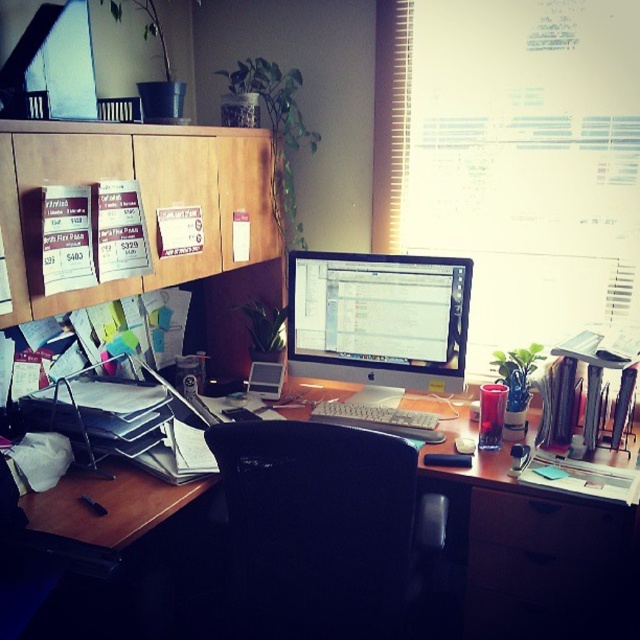
Is wooden desk at center thinner than satin black monitor at center?

Incorrect, wooden desk at center's width is not less than satin black monitor at center's.

Can you confirm if wooden desk at center is wider than satin black monitor at center?

Yes.

What do you see at coordinates (528, 563) in the screenshot? The height and width of the screenshot is (640, 640). I see `wooden desk at center` at bounding box center [528, 563].

The width and height of the screenshot is (640, 640). I want to click on wooden desk at center, so click(528, 563).

Who is more distant from viewer, (355, 307) or (593, 538)?

Point (355, 307)

This screenshot has width=640, height=640. Describe the element at coordinates (378, 317) in the screenshot. I see `satin black monitor at center` at that location.

Who is more distant from viewer, [369,276] or [548,554]?

Point [369,276]

You are a GUI agent. You are given a task and a screenshot of the screen. Output one action in this format:
    pyautogui.click(x=<x>, y=<y>)
    Task: Click on the satin black monitor at center
    
    Given the screenshot: What is the action you would take?
    pyautogui.click(x=378, y=317)

Which is above, wooden desk at center or black plastic drawer at lower right?

black plastic drawer at lower right is above.

Between wooden desk at center and black plastic drawer at lower right, which one is positioned lower?

wooden desk at center is below.

The height and width of the screenshot is (640, 640). Identify the location of wooden desk at center. (528, 563).

Where is `wooden desk at center`? This screenshot has height=640, width=640. wooden desk at center is located at coordinates (528, 563).